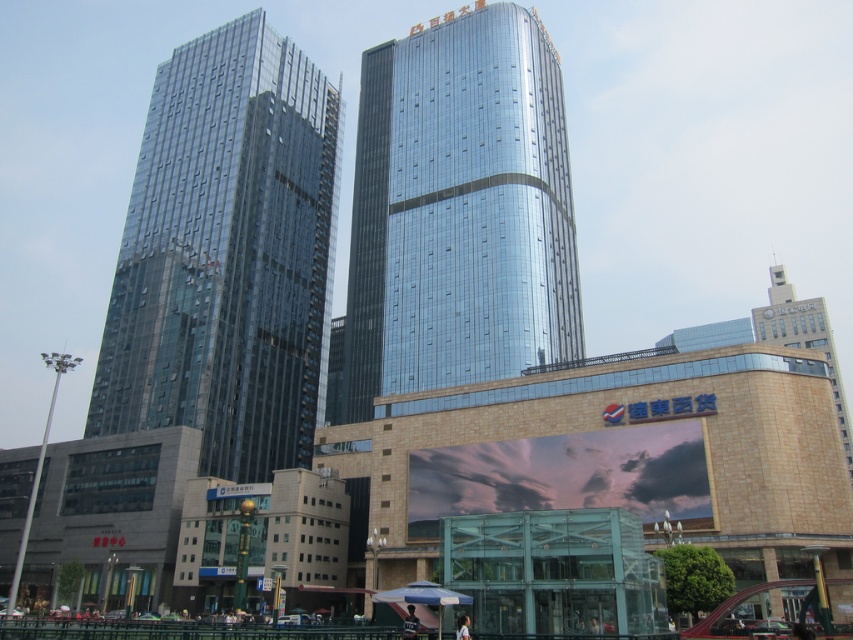
You are standing in the pedestrian area of the urban landscape and want to move from the lamppost to the entrance kiosk. The lamppost is near point (561, 296) and the entrance kiosk is near point (457, 596). Since you can only move forward, which point will you reach first?

You will reach point (561, 296) first because it is closer to you than point (457, 596), which is further away.

You are a city planner assessing the space between two glass buildings in the center. The transparent glass skyscraper at center and the glossy glass building at center. Which one has a narrower width?

The transparent glass skyscraper at center is thinner than the glossy glass building at center, so it has a narrower width.

You are a city planner reviewing the layout of the urban area. You need to determine the spatial relationship between the transparent glass skyscraper at center and the glossy glass building at center. Which one is positioned to the left?

The transparent glass skyscraper at center is to the left of the glossy glass building at center.